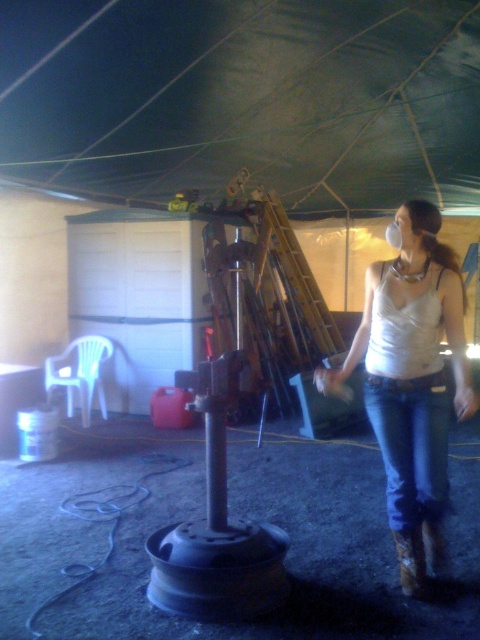
Question: Can you confirm if denim at right is smaller than brown suede cowboy boot at lower right?

Choices:
 (A) no
 (B) yes

Answer: (A)

Question: Is white matte tank top at center to the right of brown suede cowboy boot at lower right from the viewer's perspective?

Choices:
 (A) no
 (B) yes

Answer: (A)

Question: Which object is farther from the camera taking this photo?

Choices:
 (A) brown suede cowboy boot at lower right
 (B) white matte tank top at center

Answer: (A)

Question: In this image, where is denim at right located relative to brown suede cowboy boot at lower right?

Choices:
 (A) right
 (B) left

Answer: (A)

Question: Among these points, which one is farthest from the camera?

Choices:
 (A) (375, 403)
 (B) (417, 561)
 (C) (391, 493)

Answer: (C)

Question: Which point is closer to the camera?

Choices:
 (A) (420, 474)
 (B) (419, 564)
 (C) (439, 305)

Answer: (A)